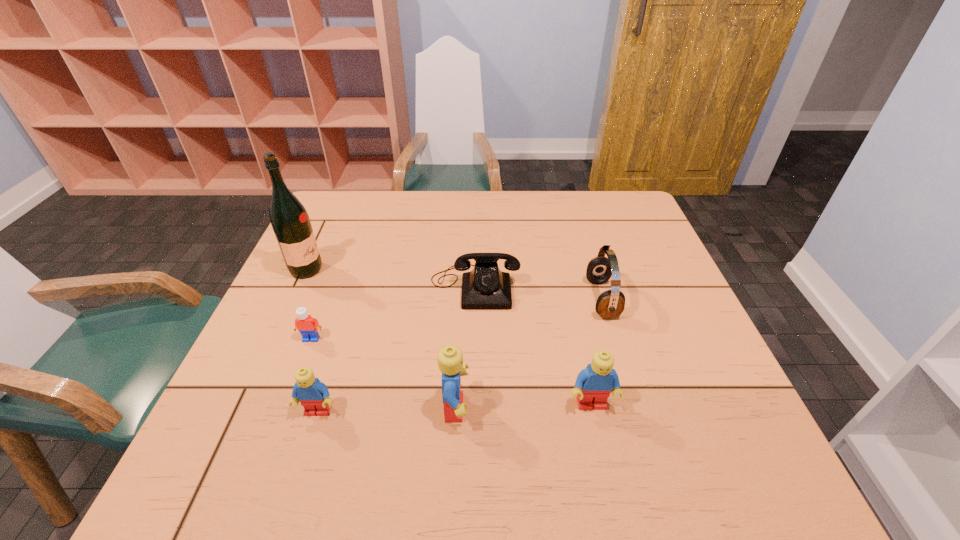
The width and height of the screenshot is (960, 540). I want to click on free space at the near edge of the desktop, so click(x=375, y=427).

Locate an element on the screen. This screenshot has width=960, height=540. free point at the left edge is located at coordinates (330, 262).

This screenshot has width=960, height=540. In the image, there is a desktop. In order to click on vacant space at the right edge in this screenshot , I will do `click(668, 296)`.

You are a GUI agent. You are given a task and a screenshot of the screen. Output one action in this format:
    pyautogui.click(x=<x>, y=<y>)
    Task: Click on the free space at the far left corner
    
    Given the screenshot: What is the action you would take?
    pyautogui.click(x=333, y=230)

Find the location of a particular element. Image resolution: width=960 pixels, height=540 pixels. free spot at the near left corner of the desktop is located at coordinates (228, 407).

Where is `vacant space at the far right corner of the desktop`? vacant space at the far right corner of the desktop is located at coordinates (610, 202).

This screenshot has width=960, height=540. I want to click on empty space that is in between the leftmost object and the third Lego from left to right, so click(x=381, y=339).

Identify the location of unoccupied area between the telephone and the third tallest Lego. (396, 349).

This screenshot has width=960, height=540. I want to click on vacant space that's between the telephone and the third tallest Lego, so click(396, 349).

The image size is (960, 540). Find the location of `empty space between the second Lego from right to left and the second shortest Lego`. empty space between the second Lego from right to left and the second shortest Lego is located at coordinates (387, 410).